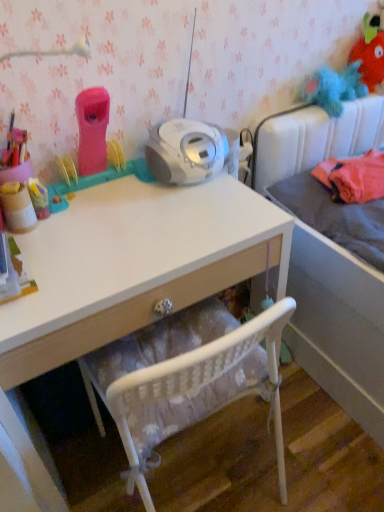
Question: Can you confirm if fluffy plush toy at upper right, positioned as the 3th toy in bottom-to-top order, is taller than white glossy desk at center?

Choices:
 (A) no
 (B) yes

Answer: (A)

Question: Is the depth of fluffy plush toy at upper right, which appears as the first toy when viewed from the top, less than that of white glossy desk at center?

Choices:
 (A) yes
 (B) no

Answer: (B)

Question: Is fluffy plush toy at upper right, the 3th toy viewed from the front, far from white glossy desk at center?

Choices:
 (A) yes
 (B) no

Answer: (A)

Question: Considering the relative sizes of fluffy plush toy at upper right, positioned as the 3th toy in bottom-to-top order, and white glossy desk at center in the image provided, is fluffy plush toy at upper right, positioned as the 3th toy in bottom-to-top order, smaller than white glossy desk at center?

Choices:
 (A) yes
 (B) no

Answer: (A)

Question: Is fluffy plush toy at upper right, the third toy when ordered from left to right, at the left side of white glossy desk at center?

Choices:
 (A) yes
 (B) no

Answer: (B)

Question: Is gray fabric bed at upper right in front of or behind matte brown jar at left, which ranks as the 1th toy in left-to-right order, in the image?

Choices:
 (A) behind
 (B) front

Answer: (B)

Question: Would you say gray fabric bed at upper right is inside or outside matte brown jar at left, placed as the third toy when sorted from top to bottom?

Choices:
 (A) outside
 (B) inside

Answer: (A)

Question: Based on their sizes in the image, would you say gray fabric bed at upper right is bigger or smaller than matte brown jar at left, which ranks as the 1th toy in left-to-right order?

Choices:
 (A) small
 (B) big

Answer: (B)

Question: Is point (286, 285) positioned closer to the camera than point (16, 221)?

Choices:
 (A) closer
 (B) farther

Answer: (B)

Question: In terms of width, does fluffy plush toy at upper right, positioned as the 3th toy in bottom-to-top order, look wider or thinner when compared to matte brown jar at left, marked as the 1th toy in a bottom-to-top arrangement?

Choices:
 (A) wide
 (B) thin

Answer: (A)

Question: In terms of height, does fluffy plush toy at upper right, placed as the first toy when sorted from back to front, look taller or shorter compared to matte brown jar at left, which appears as the third toy when viewed from the back?

Choices:
 (A) tall
 (B) short

Answer: (A)

Question: Is fluffy plush toy at upper right, the third toy when ordered from left to right, to the left or to the right of matte brown jar at left, which appears as the third toy when viewed from the back, in the image?

Choices:
 (A) left
 (B) right

Answer: (B)

Question: Relative to matte brown jar at left, which is the first toy from front to back, is fluffy plush toy at upper right, the third toy when ordered from left to right, in front or behind?

Choices:
 (A) behind
 (B) front

Answer: (A)

Question: Relative to gray fabric mattress at right, is gray fabric bed at upper right in front or behind?

Choices:
 (A) front
 (B) behind

Answer: (A)

Question: In terms of height, does gray fabric bed at upper right look taller or shorter compared to gray fabric mattress at right?

Choices:
 (A) tall
 (B) short

Answer: (A)